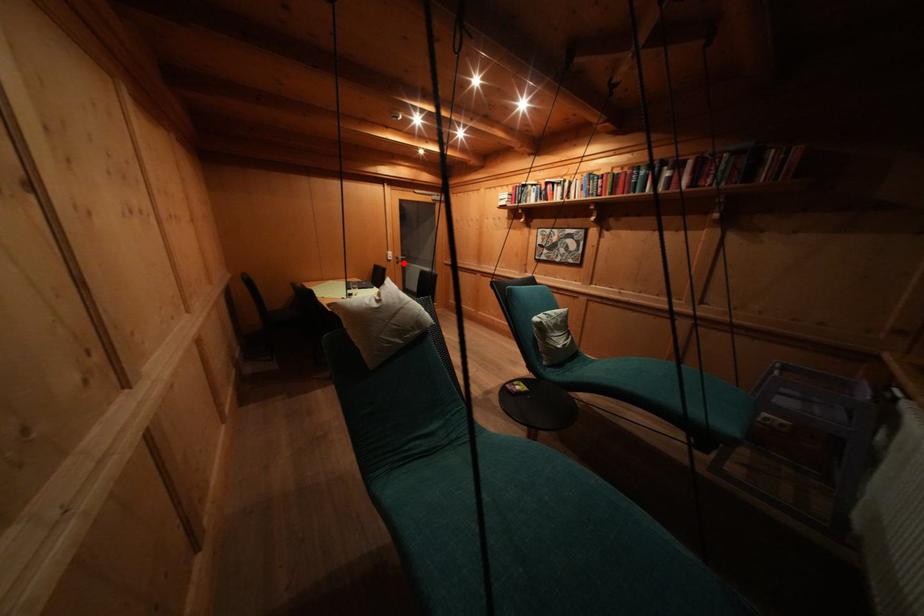
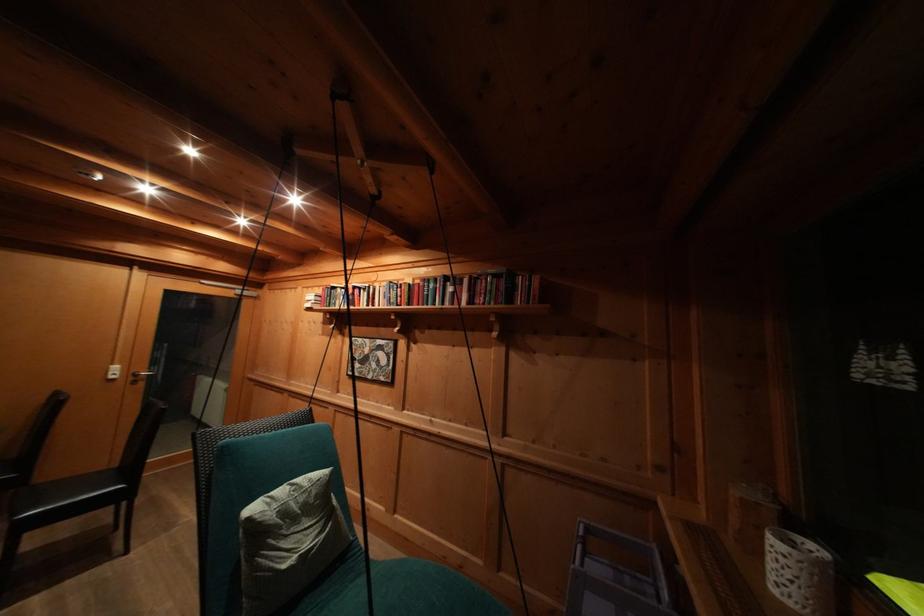
Locate, in the second image, the point that corresponds to the highlighted location in the first image.

(141, 379)